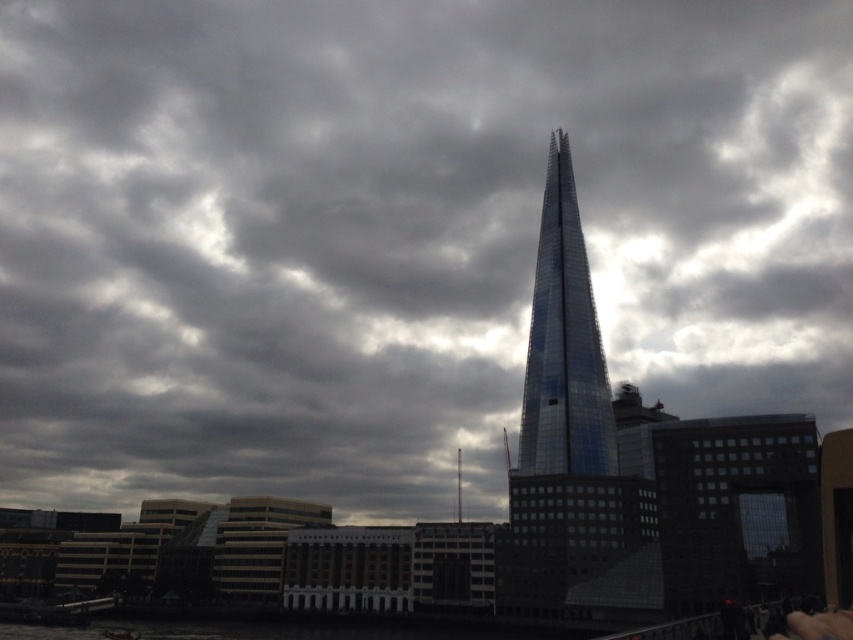
Which of these two, glassy steel tower at center or shiny glass tower at center, stands shorter?

shiny glass tower at center

Does glassy steel tower at center have a greater height compared to shiny glass tower at center?

Yes.

Is point (567, 513) in front of point (590, 404)?

Yes.

Identify the location of glassy steel tower at center. (572, 442).

The width and height of the screenshot is (853, 640). In order to click on shiny glass tower at center in this screenshot , I will do tap(564, 342).

Can you confirm if shiny glass tower at center is thinner than glassy metallic spire at center?

No.

The width and height of the screenshot is (853, 640). In order to click on shiny glass tower at center in this screenshot , I will do `click(564, 342)`.

Between glassy steel tower at center and glassy metallic spire at center, which one appears on the left side from the viewer's perspective?

glassy metallic spire at center is more to the left.

Can you confirm if glassy steel tower at center is bigger than glassy metallic spire at center?

Yes, glassy steel tower at center is bigger than glassy metallic spire at center.

Does point (627, 560) come closer to viewer compared to point (456, 499)?

Yes, it is in front of point (456, 499).

At what (x,y) coordinates should I click in order to perform the action: click on glassy steel tower at center. Please return your answer as a coordinate pair (x, y). The width and height of the screenshot is (853, 640). Looking at the image, I should click on coord(572,442).